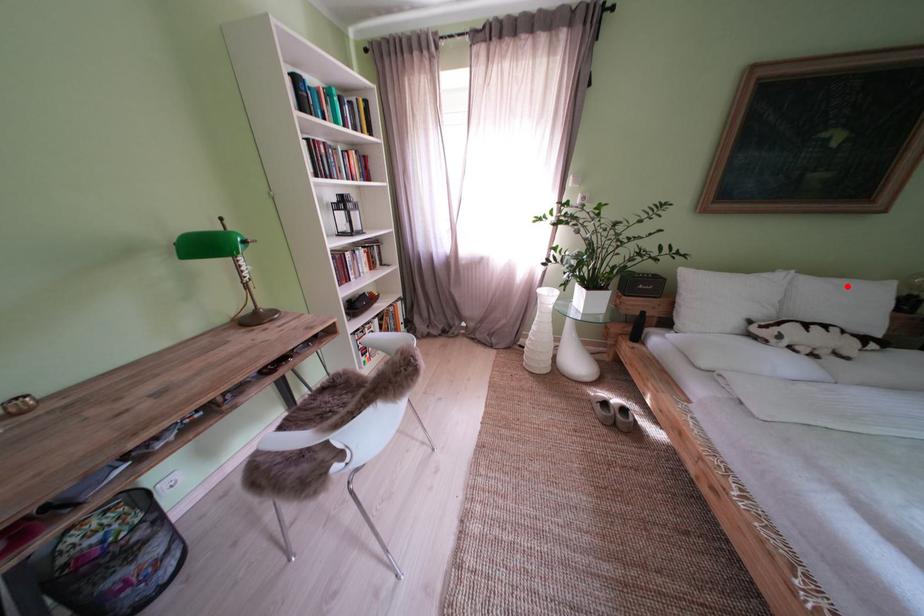
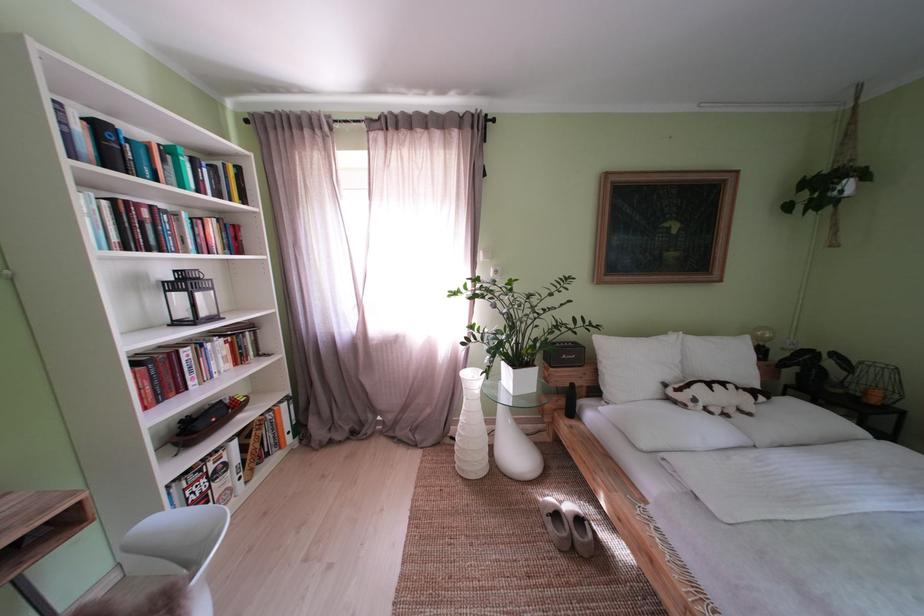
The point at the highlighted location is marked in the first image. Where is the corresponding point in the second image?

(723, 344)